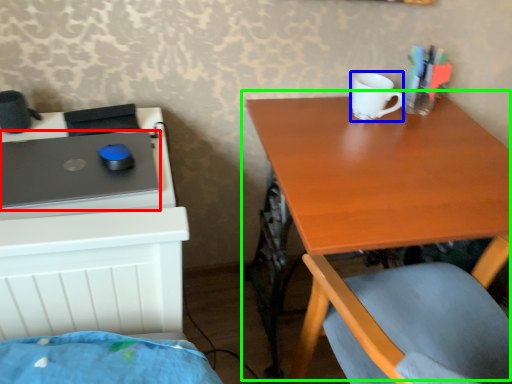
Question: Which is nearer to the laptop (highlighted by a red box)? mug (highlighted by a blue box) or table (highlighted by a green box).

Choices:
 (A) mug
 (B) table

Answer: (B)